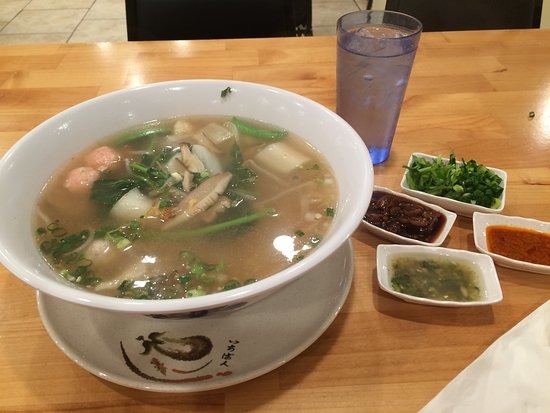
Image resolution: width=550 pixels, height=413 pixels. Identify the location of dish. (291, 332).